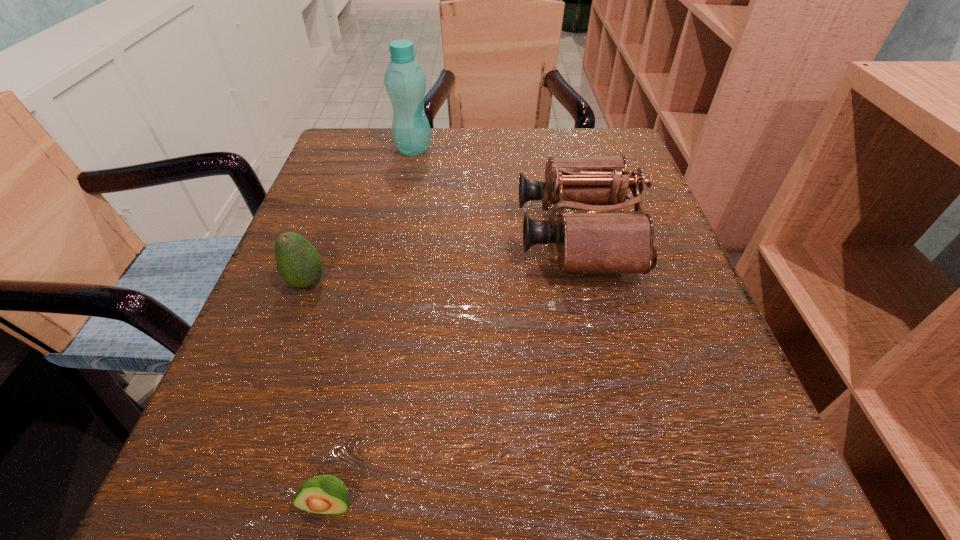
The width and height of the screenshot is (960, 540). I want to click on vacant area that lies between the rightmost object and the nearer avocado, so click(453, 369).

I want to click on vacant space that is in between the left avocado and the right avocado, so click(319, 393).

Find the location of a particular element. This screenshot has height=540, width=960. free space between the second tallest object and the nearest object is located at coordinates (453, 369).

Locate an element on the screen. Image resolution: width=960 pixels, height=540 pixels. free area in between the tallest object and the rightmost object is located at coordinates (495, 192).

Where is `free space between the rightmost object and the tallest object`? free space between the rightmost object and the tallest object is located at coordinates (495, 192).

Where is `object that stands as the third closest to the third shortest object`? The width and height of the screenshot is (960, 540). object that stands as the third closest to the third shortest object is located at coordinates (324, 494).

Identify which object is located as the nearest to the third shortest object. Please provide its 2D coordinates. Your answer should be formatted as a tuple, i.e. [(x, y)], where the tuple contains the x and y coordinates of a point satisfying the conditions above.

[(405, 81)]

Locate an element on the screen. This screenshot has width=960, height=540. free space that satisfies the following two spatial constraints: 1. through the eyepieces of the rightmost object; 2. on the front side of the leftmost object is located at coordinates (588, 282).

This screenshot has height=540, width=960. In order to click on free space that satisfies the following two spatial constraints: 1. through the eyepieces of the rightmost object; 2. on the cut side of the shorter avocado in this screenshot , I will do pos(639,504).

Find the location of `vacant space that satisfies the following two spatial constraints: 1. through the eyepieces of the rightmost object; 2. on the front side of the taller avocado`. vacant space that satisfies the following two spatial constraints: 1. through the eyepieces of the rightmost object; 2. on the front side of the taller avocado is located at coordinates (588, 282).